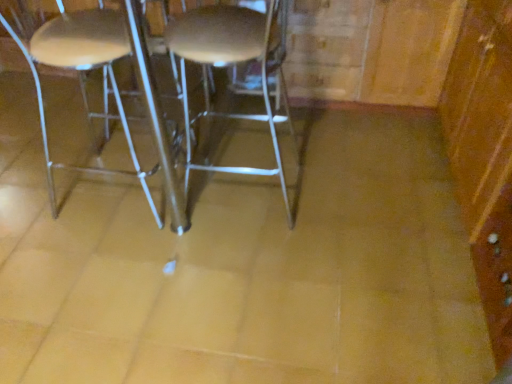
Identify the location of free space to the back side of metallic silver stool at left. This screenshot has height=384, width=512. (130, 135).